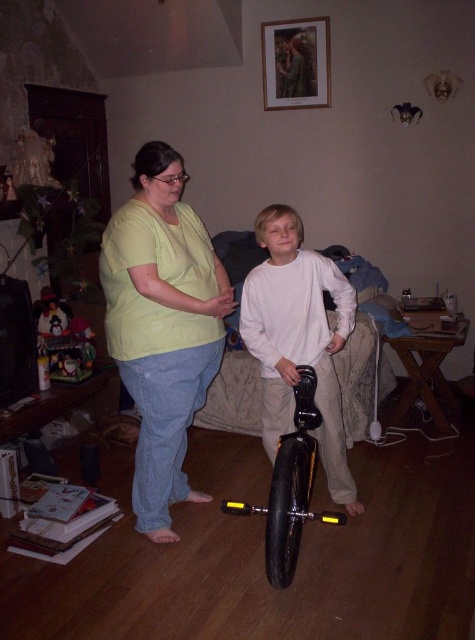
Is light green t-shirt at center positioned behind white matte unicycle at center?

No, light green t-shirt at center is in front of white matte unicycle at center.

Image resolution: width=475 pixels, height=640 pixels. I want to click on light green t-shirt at center, so click(x=162, y=324).

This screenshot has width=475, height=640. I want to click on white matte unicycle at center, so click(298, 339).

Between white matte unicycle at center and black rubber monocycle at center, which one has less height?

black rubber monocycle at center

Is point (338, 442) in front of point (313, 422)?

No.

In order to click on white matte unicycle at center in this screenshot , I will do `click(298, 339)`.

Does light green t-shirt at center appear under black rubber monocycle at center?

Incorrect, light green t-shirt at center is not positioned below black rubber monocycle at center.

Does light green t-shirt at center have a lesser height compared to black rubber monocycle at center?

Incorrect, light green t-shirt at center's height does not fall short of black rubber monocycle at center's.

Between point (123, 253) and point (313, 400), which one is positioned in front?

Point (123, 253)

At what (x,y) coordinates should I click in order to perform the action: click on light green t-shirt at center. Please return your answer as a coordinate pair (x, y). Image resolution: width=475 pixels, height=640 pixels. Looking at the image, I should click on (162, 324).